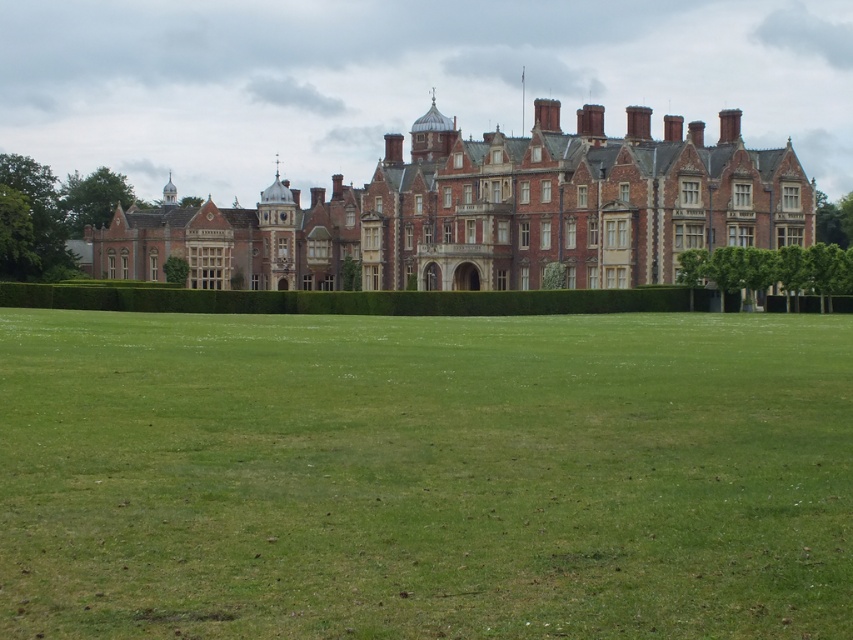
Describe the element at coordinates (424, 476) in the screenshot. This screenshot has height=640, width=853. I see `green grass at lower center` at that location.

Who is shorter, green grass at lower center or brick stone mansion at center?

With less height is green grass at lower center.

Find the location of a particular element. The height and width of the screenshot is (640, 853). green grass at lower center is located at coordinates (424, 476).